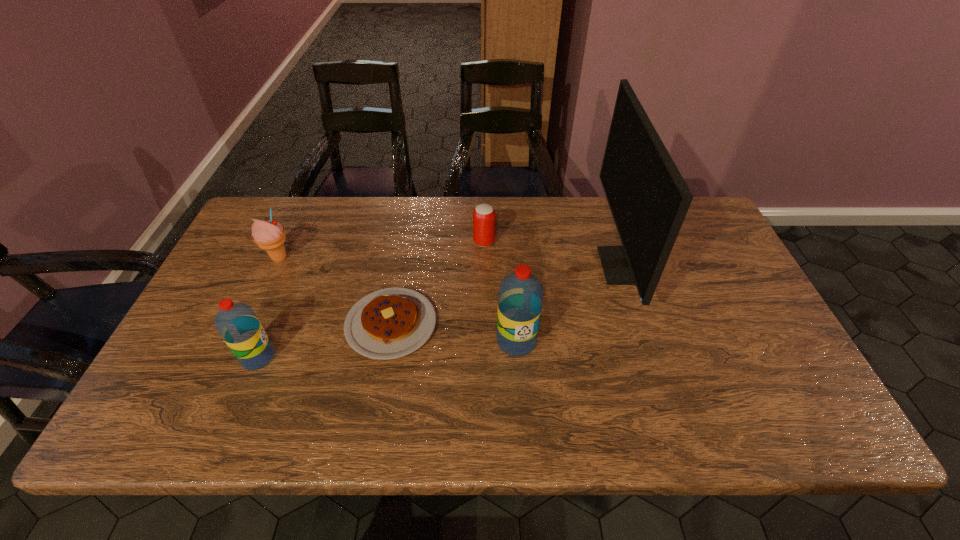
At what (x,y) coordinates should I click in order to perform the action: click on the fourth shortest object. Please return your answer as a coordinate pair (x, y). Image resolution: width=960 pixels, height=540 pixels. Looking at the image, I should click on (238, 325).

Where is `the left water bottle`? the left water bottle is located at coordinates (238, 325).

This screenshot has height=540, width=960. Identify the location of the second tallest object. (520, 298).

You are a GUI agent. You are given a task and a screenshot of the screen. Output one action in this format:
    pyautogui.click(x=<x>, y=<y>)
    Task: Click on the right water bottle
    This screenshot has height=540, width=960.
    Given the screenshot: What is the action you would take?
    pyautogui.click(x=520, y=298)

The height and width of the screenshot is (540, 960). I want to click on computer monitor, so click(648, 198).

At what (x,y) coordinates should I click in order to perform the action: click on the rightmost object. Please return your answer as a coordinate pair (x, y). The image size is (960, 540). Looking at the image, I should click on pos(648,198).

Identify the location of the third object from left to right. (389, 323).

Locate an element on the screen. the shortest object is located at coordinates (389, 323).

Identify the location of icecream. Image resolution: width=960 pixels, height=540 pixels. (270, 235).

The height and width of the screenshot is (540, 960). I want to click on beer can, so click(x=484, y=215).